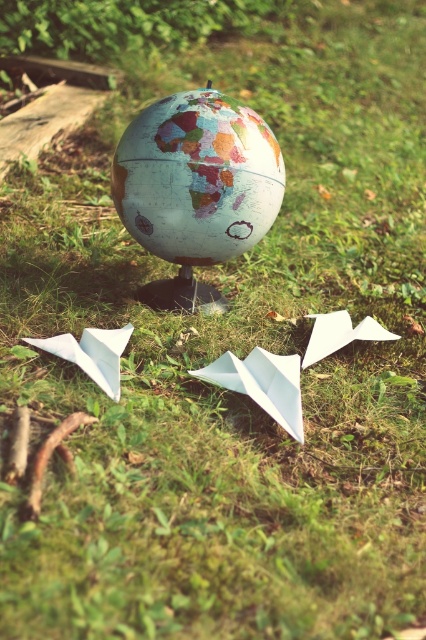
You are a child who wants to pick up the white paper airplane at center and the white paper airplane at lower right. Which one do you need to bend down more to pick up?

The white paper airplane at center is thinner than the white paper airplane at lower right, so you need to bend down more to pick up the white paper airplane at center.

Based on the photo, you are a child who wants to pick up the white paper airplane at center. The matte globe at center is in your way. Can you reach the airplane without moving the globe?

The white paper airplane at center is behind the matte globe at center, so you can reach it by going around the globe or bending down to access it from the back side.

From the picture: You are standing at the center of the globe and want to place a new paper airplane at point (92, 353). Is there already an object at that location?

Yes, there is already a white paper at lower left located at point (92, 353).